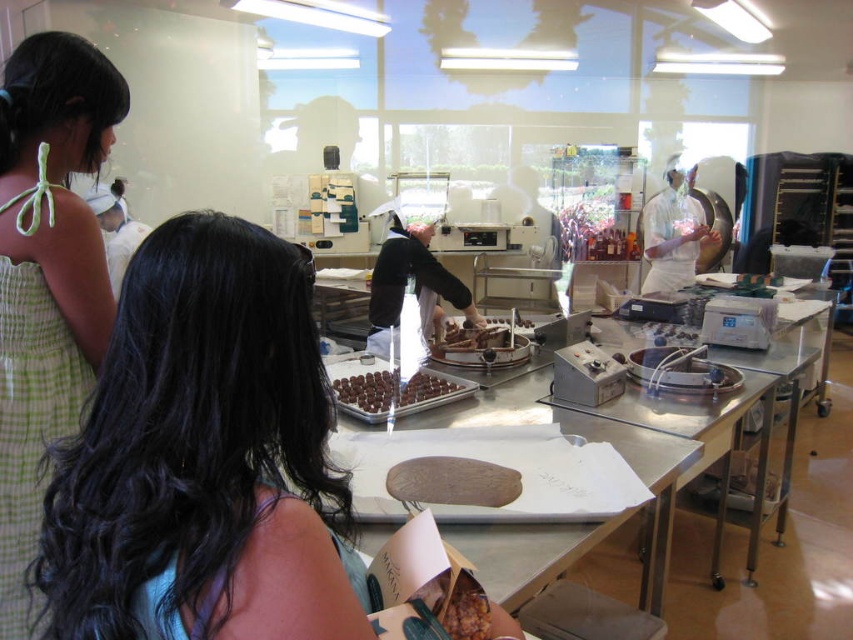
Please look at the point at coordinate [206,458]. What is the color of the surface at that point?

The point at coordinate [206,458] is on smooth black hair at center, so the color is black.

In the chocolate workshop scene, there are two items at the center area. The first is chocolate matte truffles at center and the second is chocolate matte chocolate at center. Which of these two items is positioned to the left?

The chocolate matte truffles at center is positioned to the left of chocolate matte chocolate at center.

You are a photographer standing at the back of the chocolate workshop. You want to take a closeup photo of the smooth black hair at center. The camera you are using has a minimum focusing distance of 20 inches. Can you take the photo without moving closer?

The distance between the smooth black hair at center and the camera is 21.80 inches, which is greater than the camera minimum focusing distance of 20 inches. Therefore, you can take the closeup photo without moving closer.